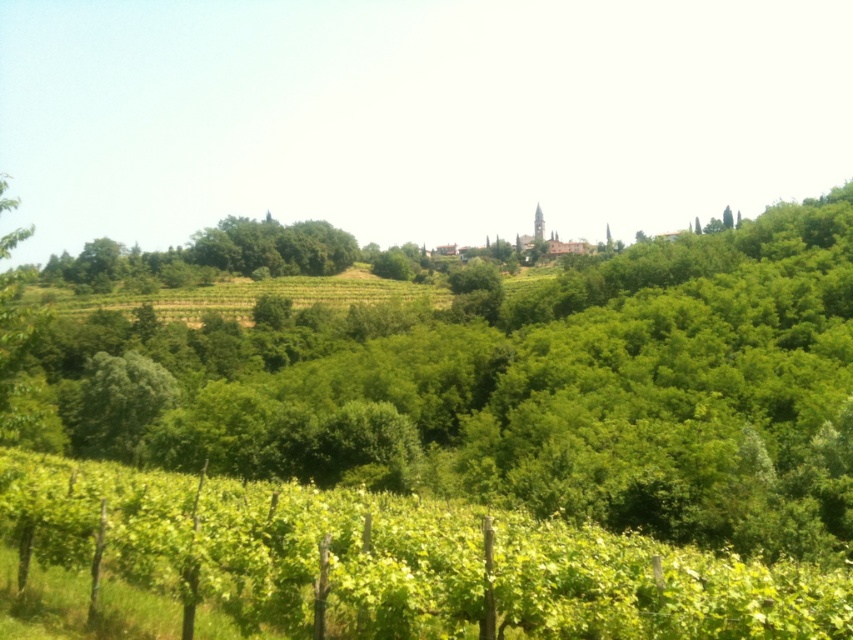
You are standing in the vineyard and want to walk towards the village located beyond the forest. Which direction should you head relative to the green leafy tree at center and the green leafy vineyard at lower center?

You should head to the right of the green leafy tree at center because it is positioned to the left of the green leafy vineyard at lower center, and the village is beyond the forest which is in that direction.

You are a landscape architect planning to install a new irrigation system between the green leafy tree at center and the green leafy vineyard at lower center. Given that the system requires a minimum of 150 feet of space between the tree and the vineyard to function properly, will the existing distance suffice?

The distance between the green leafy tree at center and the green leafy vineyard at lower center is 172.45 feet, which exceeds the required 150 feet. Therefore, the existing distance is sufficient for the irrigation system to function properly.

You are a bird flying over the rural landscape. You want to land on the tallest object between the green leafy tree at center and the green leafy vineyard at lower center. Which one should you choose?

The green leafy tree at center is taller than the green leafy vineyard at lower center, so you should choose the green leafy tree at center to land on.